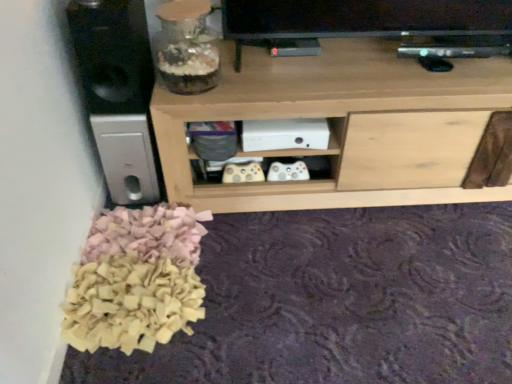
You are a GUI agent. You are given a task and a screenshot of the screen. Output one action in this format:
    pyautogui.click(x=<x>, y=<y>)
    Task: Click on the translucent glass jar at upper left
    The image size is (512, 384).
    Given the screenshot: What is the action you would take?
    pyautogui.click(x=186, y=47)

Can you confirm if natural wood shelf at center is wider than translucent glass jar at upper left?

Correct, the width of natural wood shelf at center exceeds that of translucent glass jar at upper left.

From a real-world perspective, is natural wood shelf at center physically located above or below translucent glass jar at upper left?

From a real-world perspective, natural wood shelf at center is physically below translucent glass jar at upper left.

Could you tell me if natural wood shelf at center is turned towards translucent glass jar at upper left?

No, natural wood shelf at center is not facing towards translucent glass jar at upper left.

Between natural wood shelf at center and translucent glass jar at upper left, which one has larger size?

natural wood shelf at center is bigger.

Considering the sizes of black matte speaker at left and translucent glass jar at upper left in the image, is black matte speaker at left wider or thinner than translucent glass jar at upper left?

Clearly, black matte speaker at left has more width compared to translucent glass jar at upper left.

Would you say black matte speaker at left is a long distance from translucent glass jar at upper left?

They are positioned close to each other.

Is black matte speaker at left positioned with its back to translucent glass jar at upper left?

No, black matte speaker at left's orientation is not away from translucent glass jar at upper left.

Considering the sizes of objects natural wood shelf at center and black matte speaker at left in the image provided, who is taller, natural wood shelf at center or black matte speaker at left?

With more height is natural wood shelf at center.

The height and width of the screenshot is (384, 512). Find the location of `speaker that appears above the natural wood shelf at center (from a real-world perspective)`. speaker that appears above the natural wood shelf at center (from a real-world perspective) is located at coordinates tap(112, 54).

From the image's perspective, between natural wood shelf at center and black matte speaker at left, who is located below?

From the image's view, natural wood shelf at center is below.

Looking at this image, in the image, is natural wood shelf at center on the left side or the right side of black matte speaker at left?

From the image, it's evident that natural wood shelf at center is to the right of black matte speaker at left.

From a real-world perspective, who is located higher, black matte speaker at left or natural wood shelf at center?

black matte speaker at left, from a real-world perspective.

Where is `shelf below the black matte speaker at left (from the image's perspective)`? shelf below the black matte speaker at left (from the image's perspective) is located at coordinates (344, 126).

Can you see black matte speaker at left touching natural wood shelf at center?

No, black matte speaker at left is not touching natural wood shelf at center.

Is black matte speaker at left smaller than natural wood shelf at center?

Yes, black matte speaker at left is smaller than natural wood shelf at center.

Which object is thinner, translucent glass jar at upper left or black matte speaker at left?

Thinner between the two is translucent glass jar at upper left.

Considering the relative sizes of translucent glass jar at upper left and black matte speaker at left in the image provided, is translucent glass jar at upper left bigger than black matte speaker at left?

Actually, translucent glass jar at upper left might be smaller than black matte speaker at left.

Is translucent glass jar at upper left directly adjacent to black matte speaker at left?

No, translucent glass jar at upper left is not beside black matte speaker at left.

Which object is more forward, translucent glass jar at upper left or natural wood shelf at center?

Positioned in front is translucent glass jar at upper left.

I want to click on glass vase above the natural wood shelf at center (from a real-world perspective), so point(186,47).

Is translucent glass jar at upper left far from natural wood shelf at center?

They are positioned close to each other.

Can you confirm if translucent glass jar at upper left is smaller than natural wood shelf at center?

Correct, translucent glass jar at upper left occupies less space than natural wood shelf at center.

Locate an element on the screen. This screenshot has width=512, height=384. shelf lying on the right of translucent glass jar at upper left is located at coordinates (344, 126).

This screenshot has width=512, height=384. Find the location of `speaker in front of the translucent glass jar at upper left`. speaker in front of the translucent glass jar at upper left is located at coordinates (112, 54).

Which object lies further to the anchor point translucent glass jar at upper left, black matte speaker at left or natural wood shelf at center?

natural wood shelf at center.

Which object lies further to the anchor point natural wood shelf at center, translucent glass jar at upper left or black matte speaker at left?

Among the two, black matte speaker at left is located further to natural wood shelf at center.

From the image, which object appears to be farther from translucent glass jar at upper left, natural wood shelf at center or black matte speaker at left?

natural wood shelf at center is positioned further to the anchor translucent glass jar at upper left.

When comparing their distances from black matte speaker at left, does translucent glass jar at upper left or natural wood shelf at center seem closer?

Among the two, translucent glass jar at upper left is located nearer to black matte speaker at left.

Looking at the image, which one is located closer to natural wood shelf at center, black matte speaker at left or translucent glass jar at upper left?

translucent glass jar at upper left is positioned closer to the anchor natural wood shelf at center.

Based on their spatial positions, is natural wood shelf at center or translucent glass jar at upper left further from black matte speaker at left?

natural wood shelf at center is further to black matte speaker at left.

The width and height of the screenshot is (512, 384). Identify the location of glass vase between black matte speaker at left and natural wood shelf at center from left to right. (186, 47).